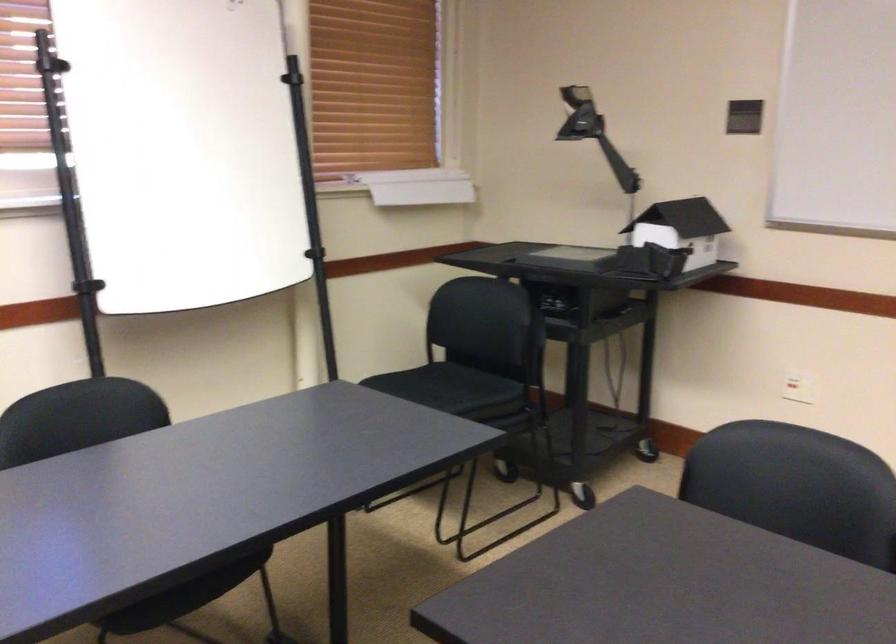
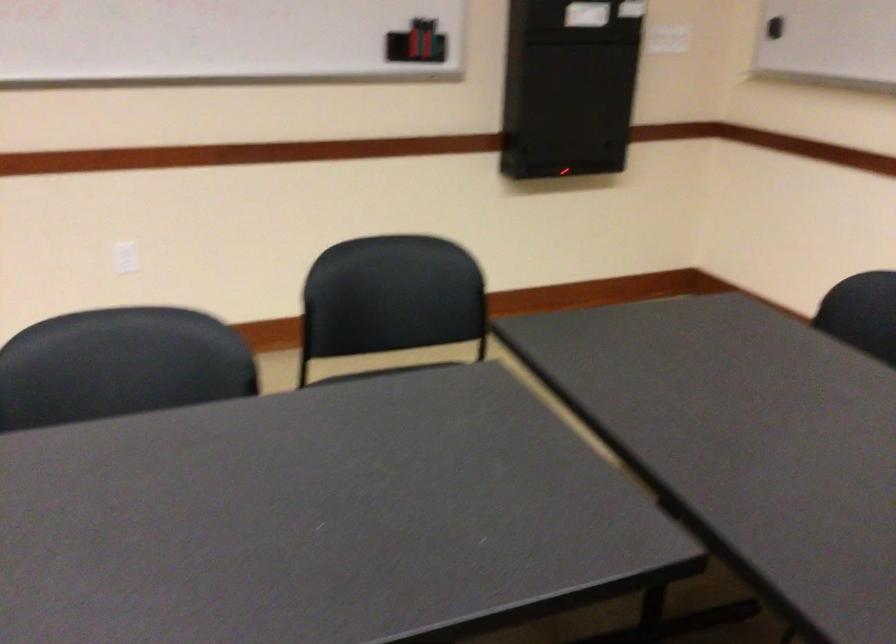
Question: The camera is either moving clockwise (left) or counter-clockwise (right) around the object. The first image is from the beginning of the video and the second image is from the end. Is the camera moving left or right when shooting the video?

Choices:
 (A) Left
 (B) Right

Answer: (A)